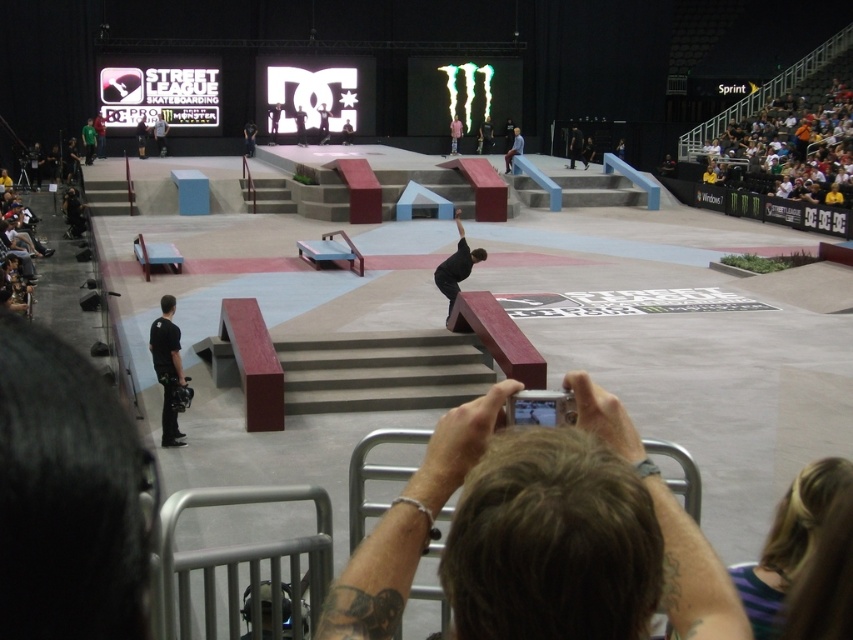
Is dark brown hair at lower center above black matte camera at center?

Indeed, dark brown hair at lower center is positioned over black matte camera at center.

Is dark brown hair at lower center bigger than black matte camera at center?

Actually, dark brown hair at lower center might be smaller than black matte camera at center.

The width and height of the screenshot is (853, 640). Describe the element at coordinates (538, 534) in the screenshot. I see `dark brown hair at lower center` at that location.

Locate an element on the screen. This screenshot has width=853, height=640. dark brown hair at lower center is located at coordinates (538, 534).

Is orange fabric crowd at upper right in front of black matte camera at center?

No, it is behind black matte camera at center.

Which is in front, point (838, 140) or point (158, 320)?

Point (158, 320) is more forward.

Locate an element on the screen. The width and height of the screenshot is (853, 640). orange fabric crowd at upper right is located at coordinates (790, 138).

Can you confirm if black matte skateboarder at center is bigger than light blue shirt at upper right?

Actually, black matte skateboarder at center might be smaller than light blue shirt at upper right.

Is black matte skateboarder at center thinner than light blue shirt at upper right?

Indeed, black matte skateboarder at center has a lesser width compared to light blue shirt at upper right.

Which is behind, point (451, 268) or point (511, 145)?

Point (511, 145)

This screenshot has width=853, height=640. In order to click on black matte skateboarder at center in this screenshot , I will do `click(456, 266)`.